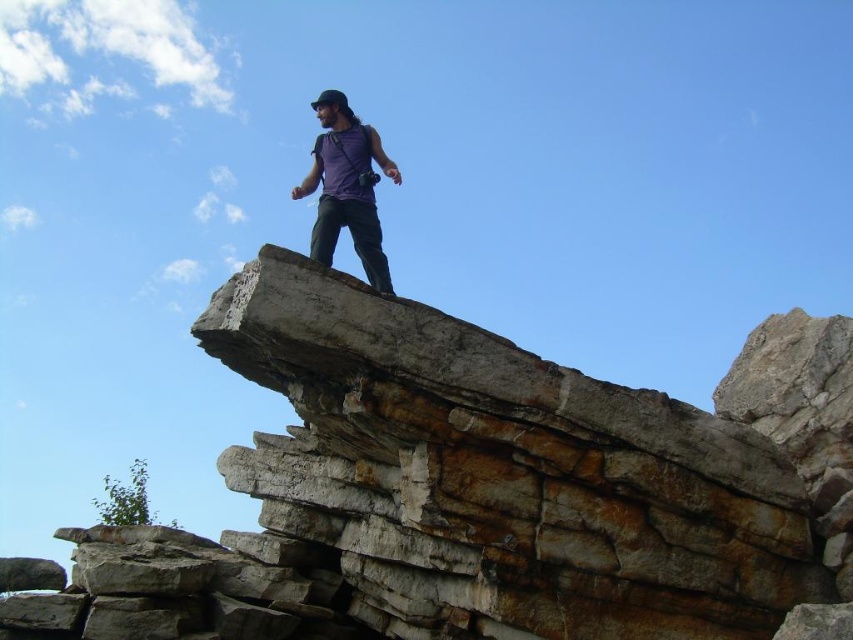
Question: Which of the following is the farthest from the observer?

Choices:
 (A) (340, 140)
 (B) (659, 636)

Answer: (A)

Question: Which object is closer to the camera taking this photo?

Choices:
 (A) rusty stone cliff at center
 (B) purple matte tank top at center

Answer: (A)

Question: Is rusty stone cliff at center wider than purple matte tank top at center?

Choices:
 (A) yes
 (B) no

Answer: (A)

Question: Can you confirm if rusty stone cliff at center is positioned to the right of purple matte tank top at center?

Choices:
 (A) yes
 (B) no

Answer: (A)

Question: Is rusty stone cliff at center to the left of purple matte tank top at center from the viewer's perspective?

Choices:
 (A) yes
 (B) no

Answer: (B)